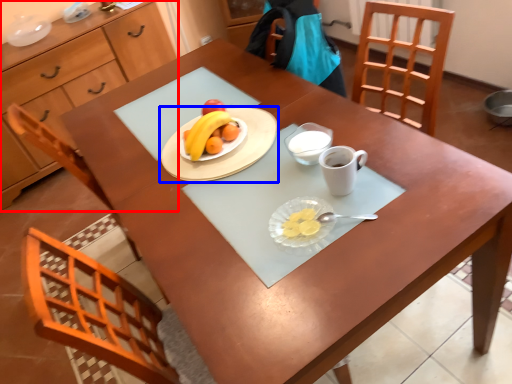
Question: Among these objects, which one is farthest to the camera, cabinetry (highlighted by a red box) or tableware (highlighted by a blue box)?

Choices:
 (A) cabinetry
 (B) tableware

Answer: (A)